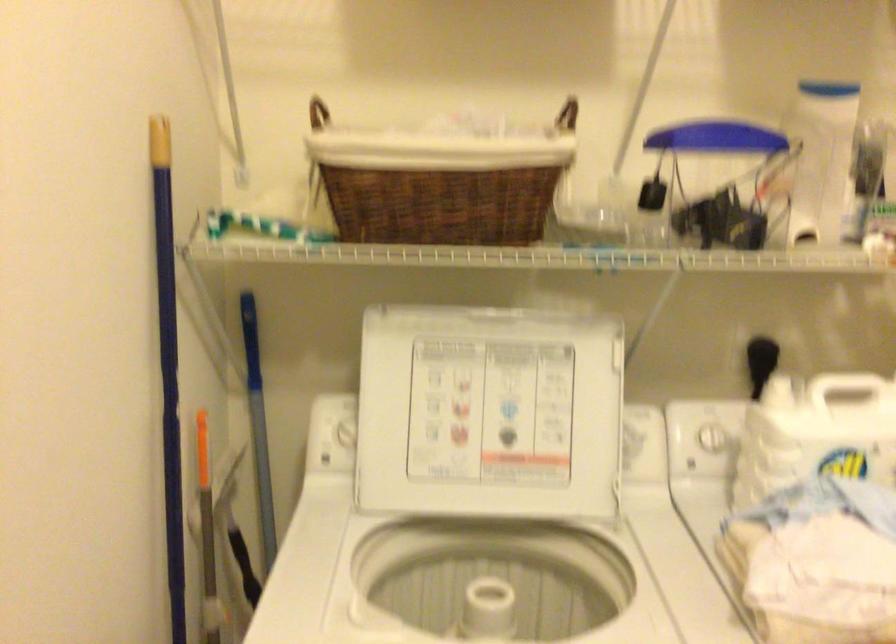
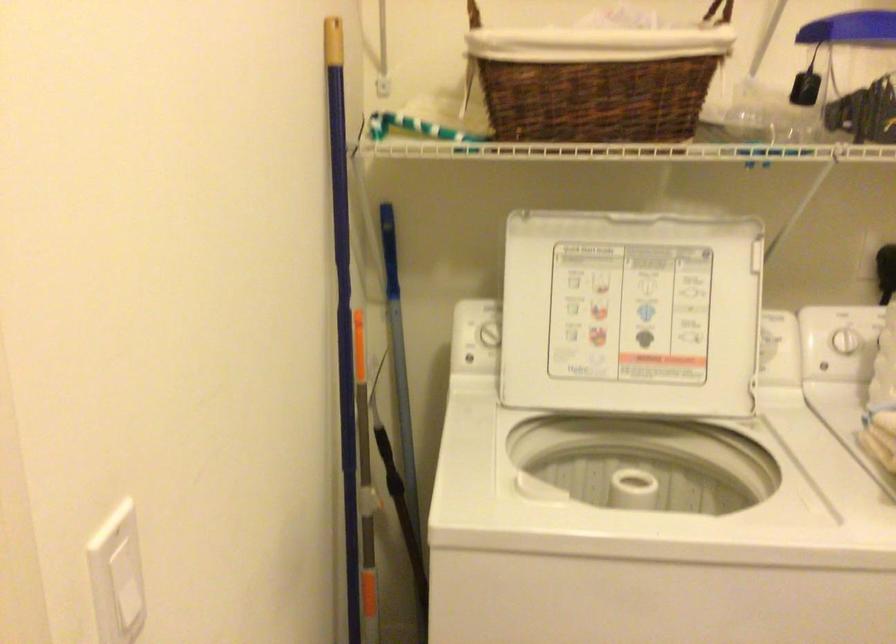
Find the pixel in the second image that matches the point at 262,476 in the first image.

(400, 379)